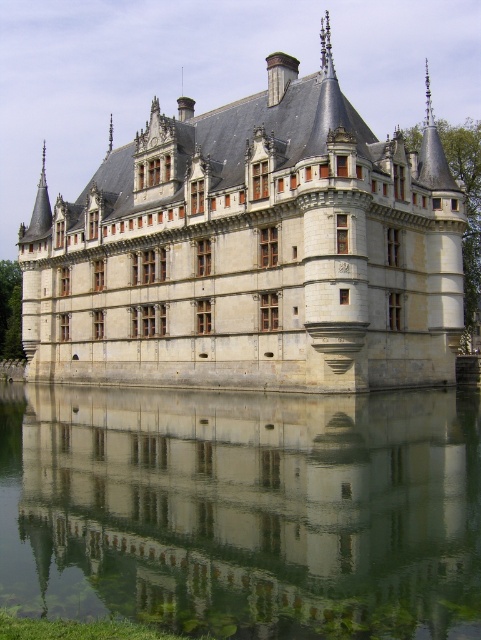
Is stone castle at center below transparent glass water at center?

No.

Between point (285, 276) and point (338, 516), which one is positioned behind?

The point (285, 276) is behind.

Where is `stone castle at center`? The height and width of the screenshot is (640, 481). stone castle at center is located at coordinates (252, 250).